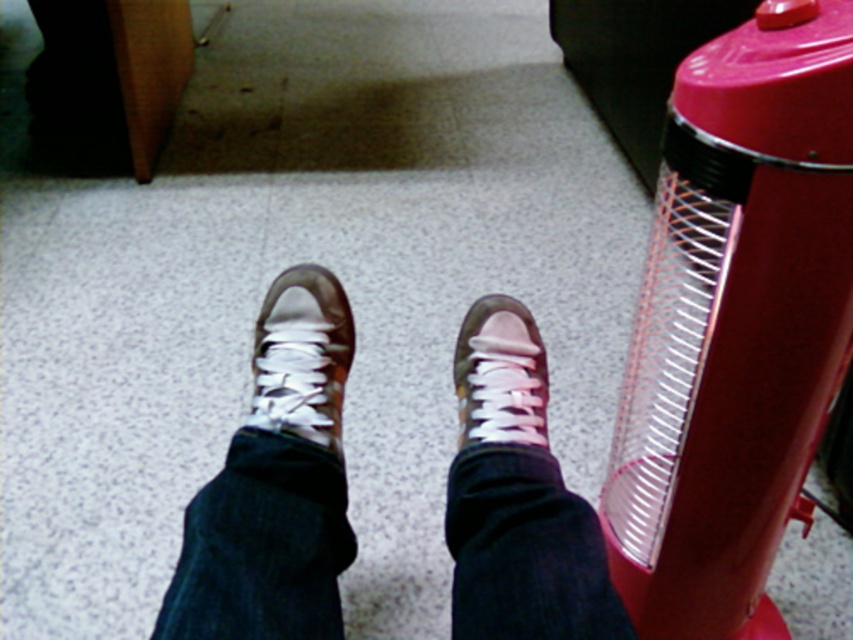
Question: Which of the following is the farthest from the observer?

Choices:
 (A) (497, 301)
 (B) (321, 433)

Answer: (A)

Question: Is matte brown sneakers at center positioned in front of white leather shoe at center?

Choices:
 (A) yes
 (B) no

Answer: (A)

Question: Does matte brown sneakers at center come behind white matte shoe at center?

Choices:
 (A) yes
 (B) no

Answer: (B)

Question: Which object is the farthest from the white leather shoe at center?

Choices:
 (A) white matte shoe at center
 (B) matte brown sneakers at center

Answer: (A)

Question: Estimate the real-world distances between objects in this image. Which object is closer to the white leather shoe at center?

Choices:
 (A) matte brown sneakers at center
 (B) white matte shoe at center

Answer: (A)

Question: Does matte brown sneakers at center appear over white leather shoe at center?

Choices:
 (A) yes
 (B) no

Answer: (B)